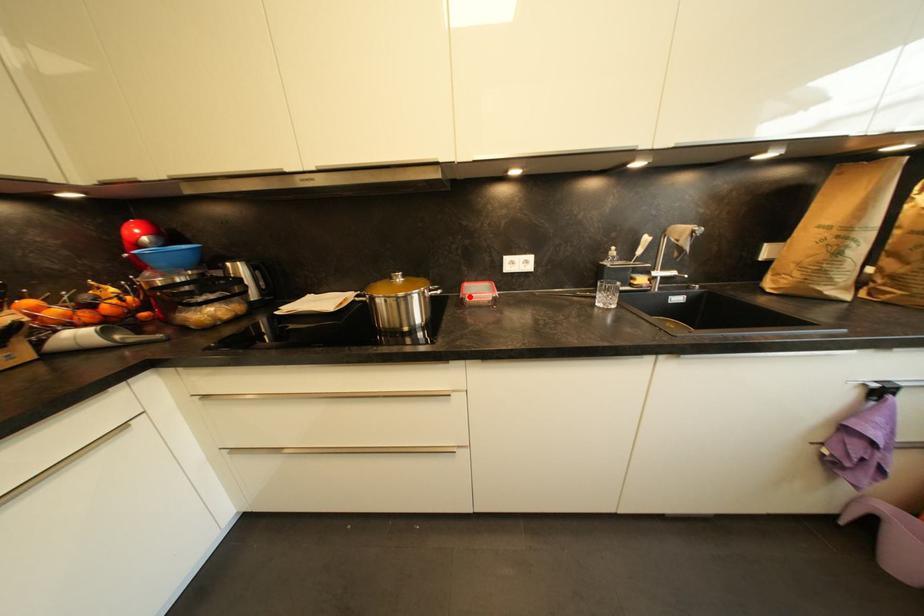
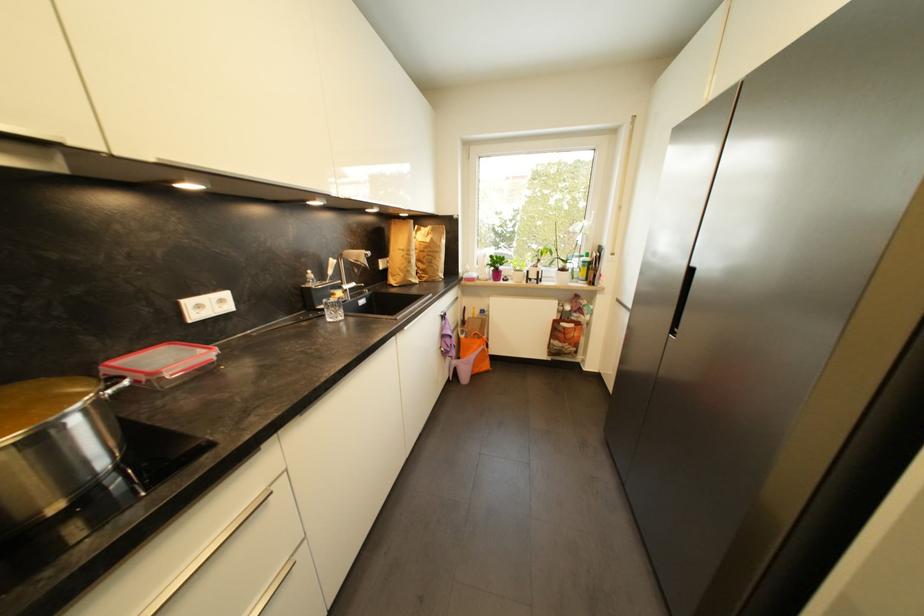
The point at the highlighted location is marked in the first image. Where is the corresponding point in the second image?

(162, 375)